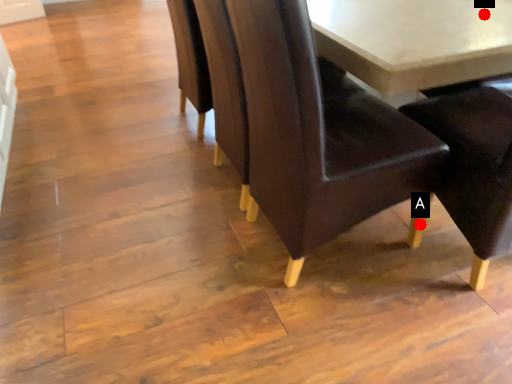
Question: Two points are circled on the image, labeled by A and B beside each circle. Which point is further to the camera?

Choices:
 (A) A is further
 (B) B is further

Answer: (A)